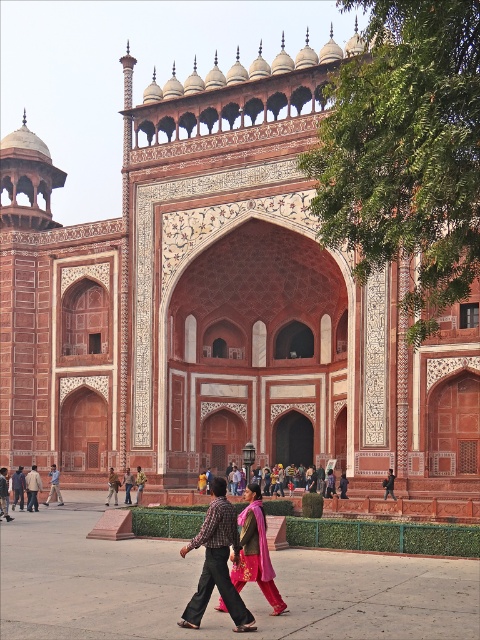
You are standing in front of the grand architectural structure. There are two points marked on the building facade. The first point is at coordinates point (x=243, y=566) and the second is at point (x=25, y=477). Which point is closer to your viewpoint?

Point (x=243, y=566) is in front of point (x=25, y=477), so it is closer to your viewpoint.

You are standing in front of the grand building and notice two points marked on the facade. The first point is at coordinates point (x=120, y=484) and the second is at point (x=33, y=493). From your vantage point, which point appears closer to you?

Point (x=33, y=493) appears closer because it is in front of point (x=120, y=484).